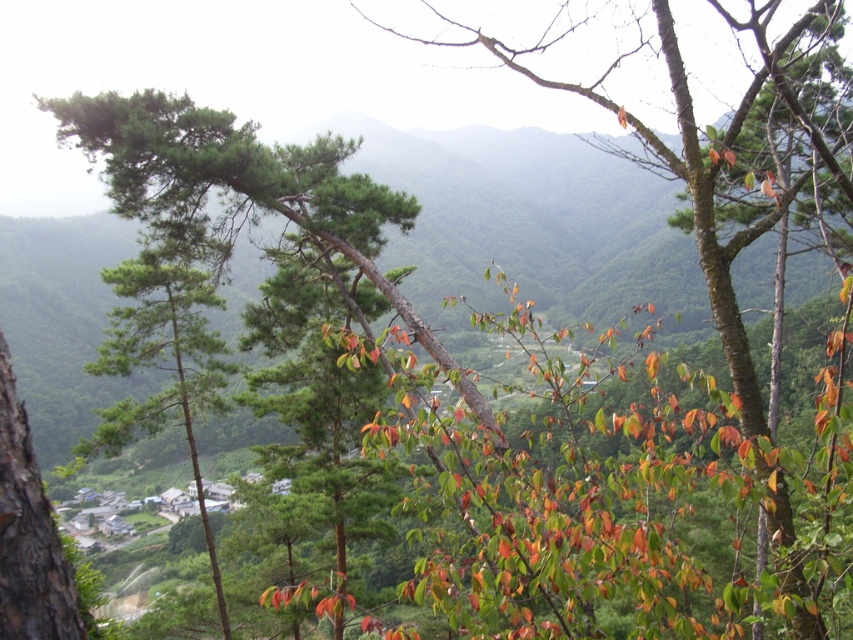
Question: Can you confirm if green matte tree at upper center is positioned to the left of green matte tree at left?

Choices:
 (A) no
 (B) yes

Answer: (A)

Question: Is green matte tree at upper center closer to camera compared to green matte tree at left?

Choices:
 (A) yes
 (B) no

Answer: (A)

Question: Is green matte tree at upper center thinner than green matte tree at left?

Choices:
 (A) no
 (B) yes

Answer: (A)

Question: Which point is farther from the camera taking this photo?

Choices:
 (A) (138, 301)
 (B) (654, 608)

Answer: (A)